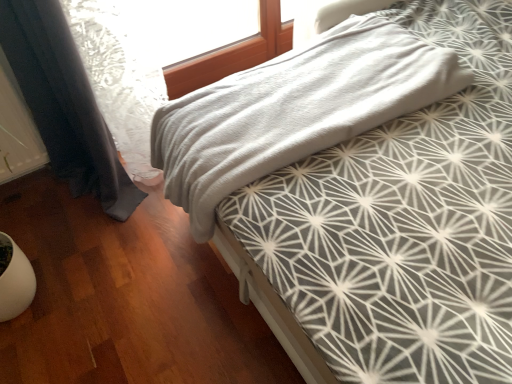
Question: Considering the relative positions of gray soft fabric bed at center and dark blue fabric curtain at left in the image provided, is gray soft fabric bed at center to the right of dark blue fabric curtain at left from the viewer's perspective?

Choices:
 (A) no
 (B) yes

Answer: (B)

Question: Is gray soft fabric bed at center in contact with dark blue fabric curtain at left?

Choices:
 (A) no
 (B) yes

Answer: (A)

Question: Does gray soft fabric bed at center have a lesser height compared to dark blue fabric curtain at left?

Choices:
 (A) yes
 (B) no

Answer: (A)

Question: Considering the relative positions of gray soft fabric bed at center and dark blue fabric curtain at left in the image provided, is gray soft fabric bed at center in front of dark blue fabric curtain at left?

Choices:
 (A) no
 (B) yes

Answer: (A)

Question: From the image's perspective, would you say gray soft fabric bed at center is shown under dark blue fabric curtain at left?

Choices:
 (A) yes
 (B) no

Answer: (B)

Question: Considering the relative sizes of gray soft fabric bed at center and dark blue fabric curtain at left in the image provided, is gray soft fabric bed at center thinner than dark blue fabric curtain at left?

Choices:
 (A) yes
 (B) no

Answer: (B)

Question: Can you confirm if dark blue fabric curtain at left is shorter than gray soft fabric bed at center?

Choices:
 (A) no
 (B) yes

Answer: (A)

Question: Considering the relative positions of dark blue fabric curtain at left and gray soft fabric bed at center in the image provided, is dark blue fabric curtain at left behind gray soft fabric bed at center?

Choices:
 (A) yes
 (B) no

Answer: (B)

Question: From a real-world perspective, does dark blue fabric curtain at left sit lower than gray soft fabric bed at center?

Choices:
 (A) no
 (B) yes

Answer: (A)

Question: From the image's perspective, does dark blue fabric curtain at left appear lower than gray soft fabric bed at center?

Choices:
 (A) no
 (B) yes

Answer: (B)

Question: From the image's perspective, would you say dark blue fabric curtain at left is positioned over gray soft fabric bed at center?

Choices:
 (A) yes
 (B) no

Answer: (B)

Question: Is dark blue fabric curtain at left turned away from gray soft fabric bed at center?

Choices:
 (A) no
 (B) yes

Answer: (A)

Question: Based on their sizes in the image, would you say gray soft fabric bed at center is bigger or smaller than dark blue fabric curtain at left?

Choices:
 (A) small
 (B) big

Answer: (A)